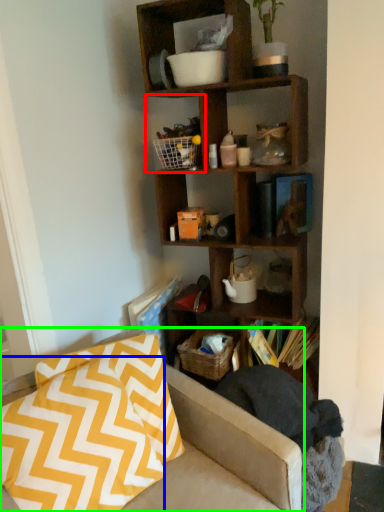
Question: Considering the real-world distances, which object is farthest from cabinet (highlighted by a red box)? pillow (highlighted by a blue box) or studio couch (highlighted by a green box)?

Choices:
 (A) pillow
 (B) studio couch

Answer: (A)